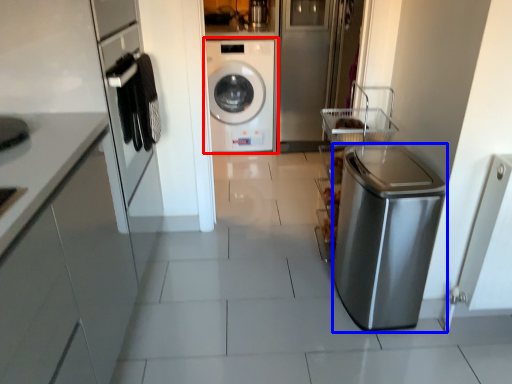
Question: Which object appears farthest to the camera in this image, washing machine (highlighted by a red box) or dish washer (highlighted by a blue box)?

Choices:
 (A) washing machine
 (B) dish washer

Answer: (A)